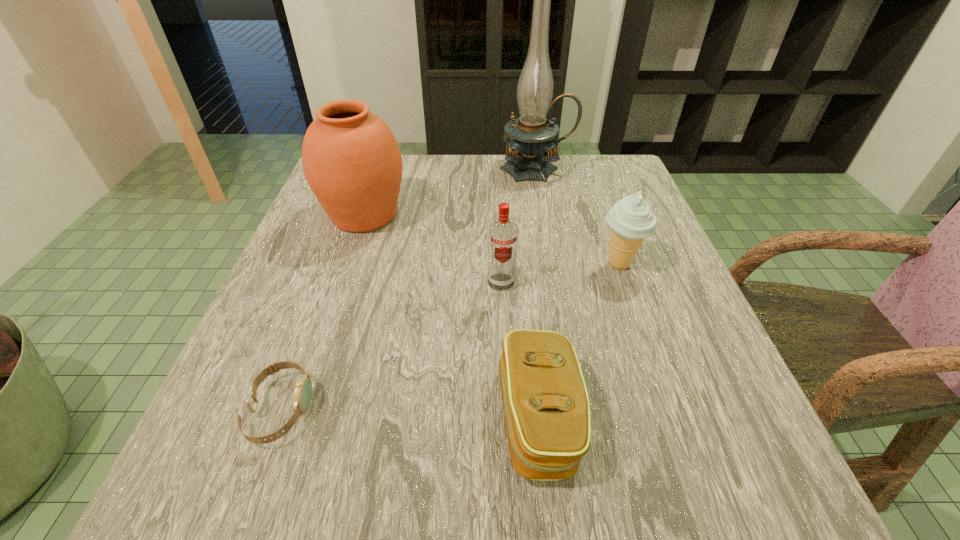
This screenshot has width=960, height=540. I want to click on oil lamp, so click(x=530, y=137).

This screenshot has height=540, width=960. Find the location of `the tallest object`. the tallest object is located at coordinates (530, 137).

Where is `urn`? This screenshot has height=540, width=960. urn is located at coordinates (351, 160).

Identify the location of the fifth nearest object. This screenshot has height=540, width=960. (351, 160).

Where is `vodka`? The height and width of the screenshot is (540, 960). vodka is located at coordinates (502, 235).

Identify the location of icecream. This screenshot has width=960, height=540. (631, 220).

Find the location of a particular element. The image size is (960, 540). clutch bag is located at coordinates (547, 411).

This screenshot has height=540, width=960. What are the coordinates of `the shortest object` in the screenshot? It's located at coord(303,391).

This screenshot has width=960, height=540. In order to click on blank space located 0.080m on the front of the farthest object in this screenshot , I will do `click(542, 201)`.

You are a GUI agent. You are given a task and a screenshot of the screen. Output one action in this format:
    pyautogui.click(x=<x>, y=<y>)
    Task: Click on the vacant space located 0.090m on the right of the fifth shortest object
    The width and height of the screenshot is (960, 540).
    Given the screenshot: What is the action you would take?
    pyautogui.click(x=448, y=214)